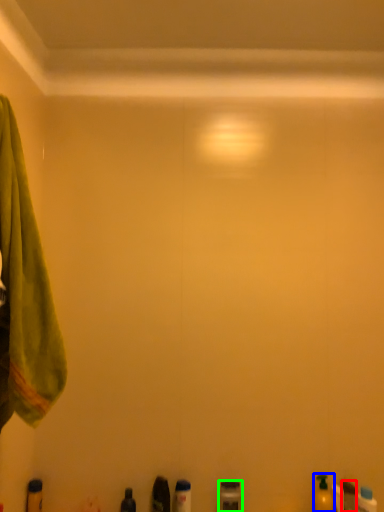
Question: Based on their relative distances, which object is nearer to toiletry (highlighted by a red box)? Choose from toiletry (highlighted by a blue box) and toiletry (highlighted by a green box).

Choices:
 (A) toiletry
 (B) toiletry

Answer: (A)